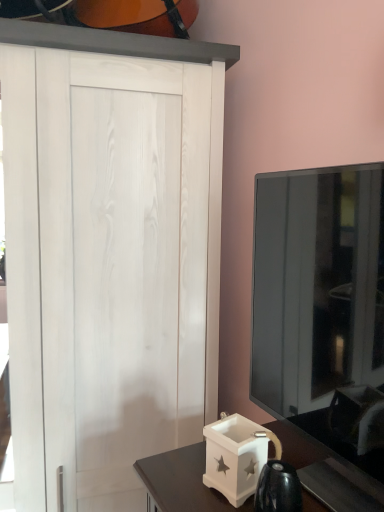
Question: Does white matte box at lower right have a smaller size compared to transparent glass tv at right?

Choices:
 (A) no
 (B) yes

Answer: (B)

Question: Is white matte box at lower right further to camera compared to transparent glass tv at right?

Choices:
 (A) yes
 (B) no

Answer: (A)

Question: Is white matte box at lower right thinner than transparent glass tv at right?

Choices:
 (A) yes
 (B) no

Answer: (A)

Question: Is white matte box at lower right wider than transparent glass tv at right?

Choices:
 (A) yes
 (B) no

Answer: (B)

Question: Is white matte box at lower right at the right side of transparent glass tv at right?

Choices:
 (A) no
 (B) yes

Answer: (A)

Question: Is white matte box at lower right outside of transparent glass tv at right?

Choices:
 (A) no
 (B) yes

Answer: (B)

Question: Can you confirm if transparent glass tv at right is positioned to the right of white matte box at lower right?

Choices:
 (A) yes
 (B) no

Answer: (A)

Question: From a real-world perspective, is transparent glass tv at right physically below white matte box at lower right?

Choices:
 (A) yes
 (B) no

Answer: (B)

Question: From the image's perspective, is transparent glass tv at right under white matte box at lower right?

Choices:
 (A) yes
 (B) no

Answer: (B)

Question: Does transparent glass tv at right have a lesser height compared to white matte box at lower right?

Choices:
 (A) yes
 (B) no

Answer: (B)

Question: From a real-world perspective, is transparent glass tv at right over white matte box at lower right?

Choices:
 (A) yes
 (B) no

Answer: (A)

Question: Is transparent glass tv at right not within white matte box at lower right?

Choices:
 (A) yes
 (B) no

Answer: (A)

Question: Considering the positions of white matte box at lower right and transparent glass tv at right in the image, is white matte box at lower right bigger or smaller than transparent glass tv at right?

Choices:
 (A) big
 (B) small

Answer: (B)